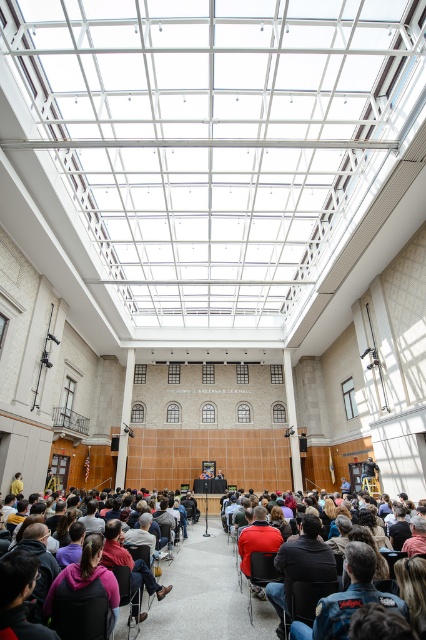
Question: Which point is farther from the camera taking this photo?

Choices:
 (A) (287, 577)
 (B) (328, 634)
 (C) (291, 614)

Answer: (C)

Question: Which point is farther from the camera taking this photo?

Choices:
 (A) (270, 566)
 (B) (271, 547)
 (C) (348, 614)

Answer: (B)

Question: From the image, what is the correct spatial relationship of denim jacket at lower center in relation to matte red shirt at center?

Choices:
 (A) above
 (B) below

Answer: (A)

Question: In this image, where is matte red shirt at center located relative to denim fabric chair at lower center?

Choices:
 (A) below
 (B) above

Answer: (B)

Question: Is matte red shirt at center below matte black chair at center?

Choices:
 (A) no
 (B) yes

Answer: (A)

Question: Which object is the closest to the dark gray jacket at center?

Choices:
 (A) matte black chair at center
 (B) denim jacket at lower center
 (C) matte red shirt at center

Answer: (A)